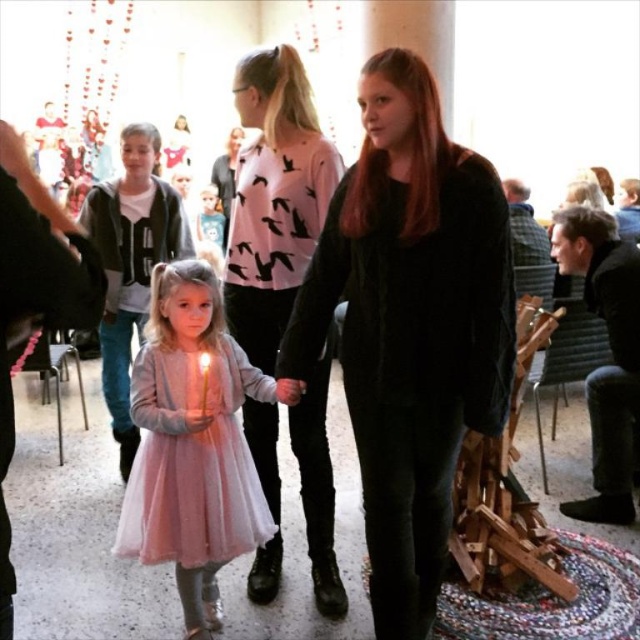
You are a photographer setting up for a group photo in the described scene. You need to ensure that both the black fuzzy coat at center and the light pink tulle dress at center are fully visible in the frame. Given their heights, which object should you position closer to the back to avoid blocking the other?

The black fuzzy coat at center is much taller than the light pink tulle dress at center. To ensure both are fully visible, position the taller black fuzzy coat at center at the back so it doesn

You are a photographer setting up for a group photo. You need to position yourself so that both the black fuzzy coat at center and the light pink tulle dress at center are in focus. Since you can only focus on one object at a time, which one should you focus on first to ensure the other is also in focus?

You should focus on the black fuzzy coat at center first because it is closer to the viewer than the light pink tulle dress at center. By focusing on the closer object, the farther one will still be within the depth of field.